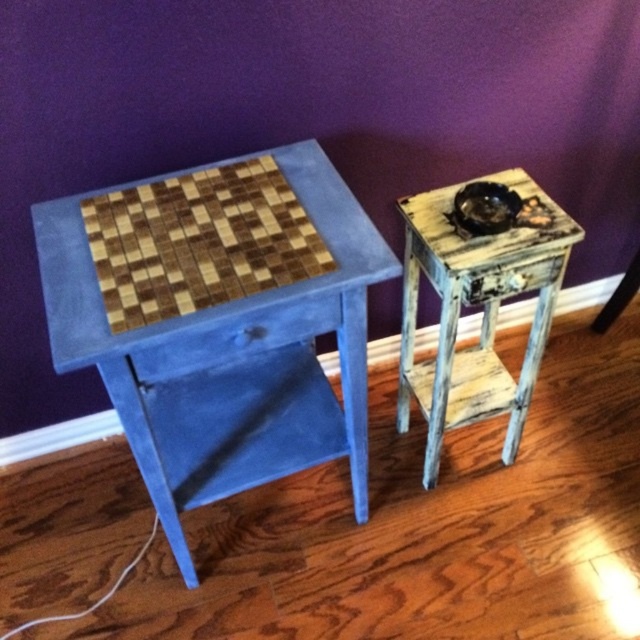
Question: Considering the relative positions of blue painted wood table at left and distressed wood side table at right in the image provided, where is blue painted wood table at left located with respect to distressed wood side table at right?

Choices:
 (A) above
 (B) below

Answer: (B)

Question: Which of the following is the farthest from the observer?

Choices:
 (A) (364, 419)
 (B) (502, 237)

Answer: (A)

Question: Does blue painted wood table at left have a larger size compared to distressed wood side table at right?

Choices:
 (A) yes
 (B) no

Answer: (A)

Question: Is blue painted wood table at left above distressed wood side table at right?

Choices:
 (A) no
 (B) yes

Answer: (A)

Question: Which of the following is the farthest from the observer?

Choices:
 (A) distressed wood side table at right
 (B) blue painted wood table at left

Answer: (A)